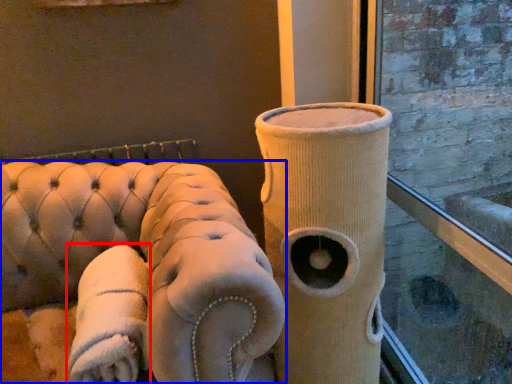
Question: Which of the following is the farthest to the observer, cloth (highlighted by a red box) or furniture (highlighted by a blue box)?

Choices:
 (A) cloth
 (B) furniture

Answer: (A)